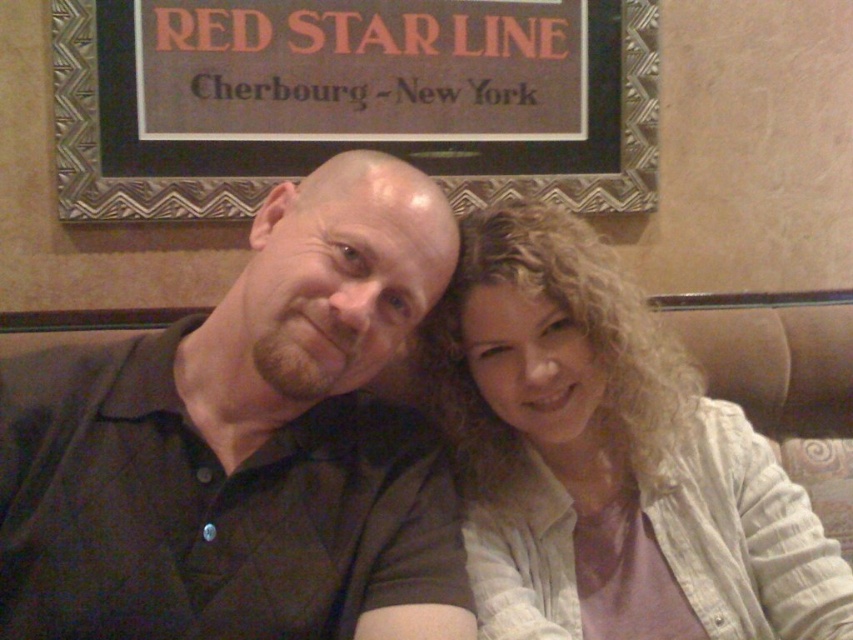
Question: Can you confirm if light beige fabric shirt at center is positioned to the left of metallic signboard at upper center?

Choices:
 (A) yes
 (B) no

Answer: (B)

Question: Which object appears closest to the camera in this image?

Choices:
 (A) light beige fabric shirt at center
 (B) dark green shirt at left
 (C) metallic signboard at upper center

Answer: (B)

Question: Which point appears closest to the camera in this image?

Choices:
 (A) (107, 184)
 (B) (399, 288)

Answer: (B)

Question: Can you confirm if dark green shirt at left is positioned below metallic signboard at upper center?

Choices:
 (A) no
 (B) yes

Answer: (B)

Question: Does dark green shirt at left lie behind metallic signboard at upper center?

Choices:
 (A) no
 (B) yes

Answer: (A)

Question: Among these points, which one is farthest from the camera?

Choices:
 (A) (132, 502)
 (B) (486, 193)
 (C) (561, 456)

Answer: (B)